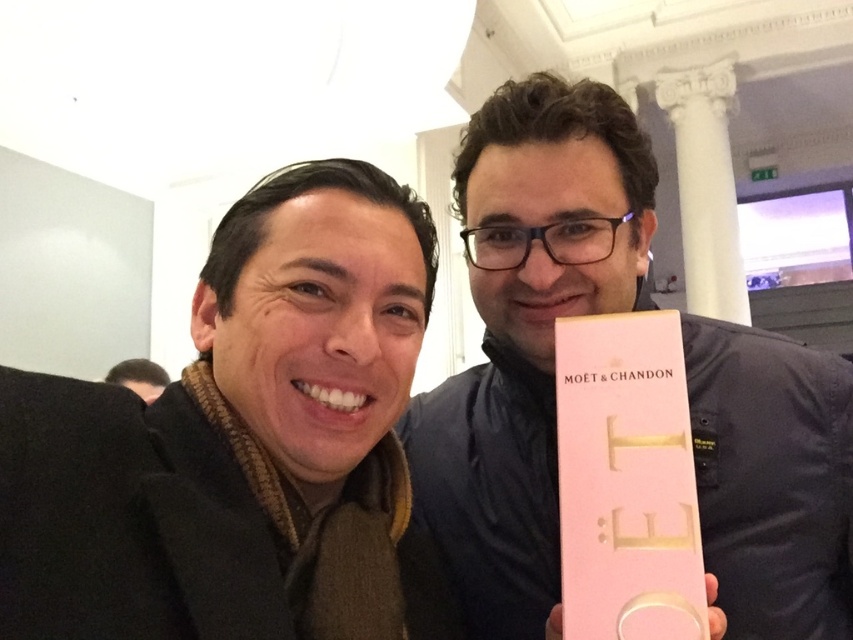
Question: Is pink matte box at right positioned before brown hair at upper left?

Choices:
 (A) no
 (B) yes

Answer: (B)

Question: Observing the image, what is the correct spatial positioning of pink matte box at right in reference to brown hair at upper left?

Choices:
 (A) right
 (B) left

Answer: (A)

Question: Is pink matte box at right smaller than brown hair at upper left?

Choices:
 (A) no
 (B) yes

Answer: (A)

Question: Which point is closer to the camera?

Choices:
 (A) pink matte box at right
 (B) brown hair at upper left

Answer: (A)

Question: Which point appears farthest from the camera in this image?

Choices:
 (A) (757, 412)
 (B) (106, 378)

Answer: (B)